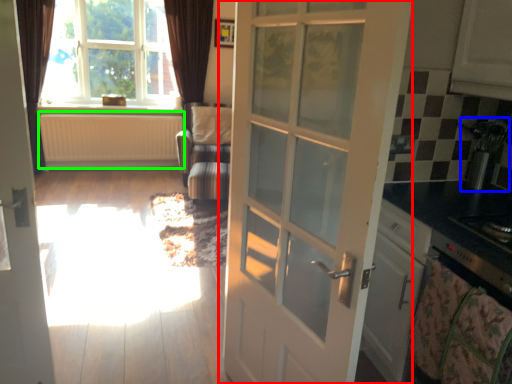
Question: Considering the real-world distances, which object is closest to door (highlighted by a red box)? appliance (highlighted by a blue box) or radiator (highlighted by a green box).

Choices:
 (A) appliance
 (B) radiator

Answer: (A)